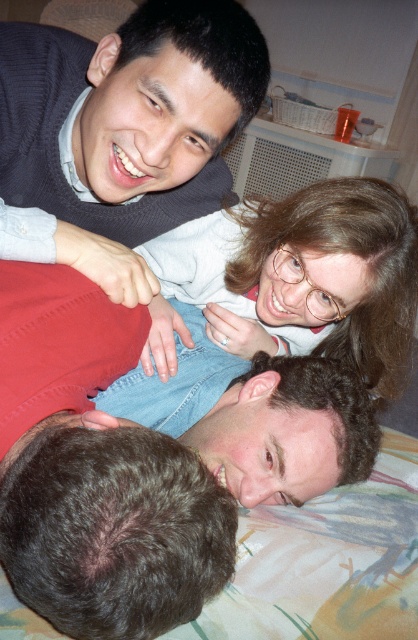
Can you confirm if dark brown hair at lower left is taller than matte gray sweater at upper left?

Incorrect, dark brown hair at lower left's height is not larger of matte gray sweater at upper left's.

In the scene shown: Can you confirm if dark brown hair at lower left is wider than matte gray sweater at upper left?

No.

The width and height of the screenshot is (418, 640). In order to click on dark brown hair at lower left in this screenshot , I will do `click(96, 472)`.

Image resolution: width=418 pixels, height=640 pixels. Find the location of `dark brown hair at lower left`. dark brown hair at lower left is located at coordinates (96, 472).

Which is below, matte blue jeans at upper center or matte gray sweater at upper left?

Answer: matte blue jeans at upper center is lower down.

Between matte blue jeans at upper center and matte gray sweater at upper left, which one appears on the left side from the viewer's perspective?

From the viewer's perspective, matte gray sweater at upper left appears more on the left side.

Who is more forward, (389, 342) or (43, 168)?

Positioned in front is point (43, 168).

Find the location of a particular element. The height and width of the screenshot is (640, 418). matte blue jeans at upper center is located at coordinates (295, 280).

Is point (60, 564) positioned behind point (218, 244)?

No, it is in front of (218, 244).

Where is `dark brown hair at lower left`? The height and width of the screenshot is (640, 418). dark brown hair at lower left is located at coordinates (96, 472).